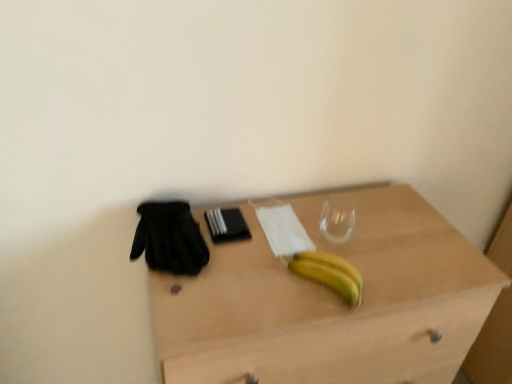
Question: Relative to yellow matte banana at center, is black mesh glove at left in front or behind?

Choices:
 (A) behind
 (B) front

Answer: (A)

Question: Is black mesh glove at left to the left or to the right of yellow matte banana at center in the image?

Choices:
 (A) right
 (B) left

Answer: (B)

Question: Which object is the closest to the black mesh glove at left?

Choices:
 (A) yellow matte banana at center
 (B) light wood desk at center

Answer: (A)

Question: Estimate the real-world distances between objects in this image. Which object is farther from the black mesh glove at left?

Choices:
 (A) yellow matte banana at center
 (B) light wood desk at center

Answer: (B)